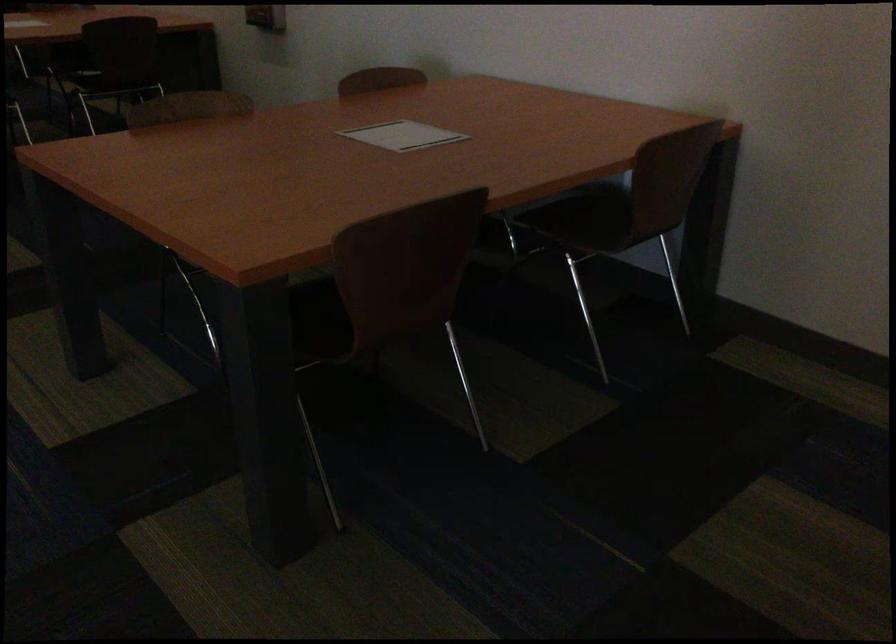
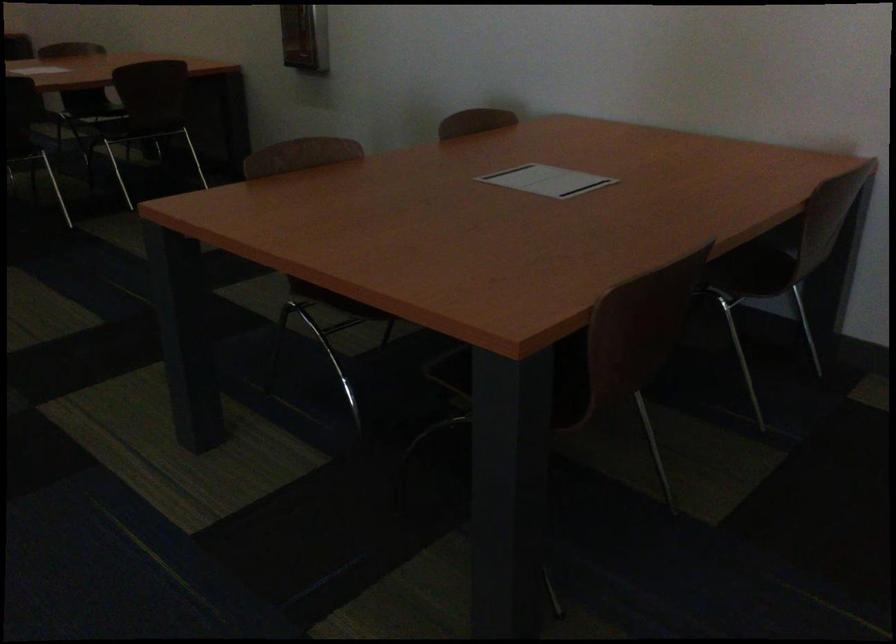
Question: Which direction would the cameraman need to move to produce the second image? Reply with the corresponding letter.

Choices:
 (A) Left
 (B) Right
 (C) Forward
 (D) Backward

Answer: (A)